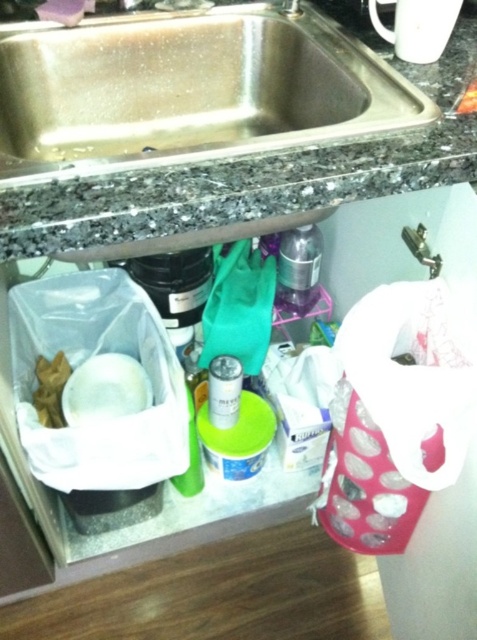
Question: Considering the relative positions of white dotted paper towel at right and metallic silver can at center in the image provided, where is white dotted paper towel at right located with respect to metallic silver can at center?

Choices:
 (A) right
 (B) left

Answer: (A)

Question: Is stainless steel sink at upper center smaller than brushed metal faucet at upper center?

Choices:
 (A) no
 (B) yes

Answer: (A)

Question: Which point is closer to the camera taking this photo?

Choices:
 (A) (268, 52)
 (B) (228, 381)
 (C) (424, 436)

Answer: (C)

Question: Which object is farther from the camera taking this photo?

Choices:
 (A) metallic silver can at center
 (B) brushed metal faucet at upper center
 (C) metallic silver shaker at center-right

Answer: (C)

Question: Based on their relative distances, which object is farther from the stainless steel sink at upper center?

Choices:
 (A) metallic silver can at center
 (B) metallic silver shaker at center-right
 (C) white dotted paper towel at right
 (D) brushed metal faucet at upper center

Answer: (A)

Question: From the image, what is the correct spatial relationship of metallic silver can at center in relation to brushed metal faucet at upper center?

Choices:
 (A) right
 (B) left

Answer: (B)